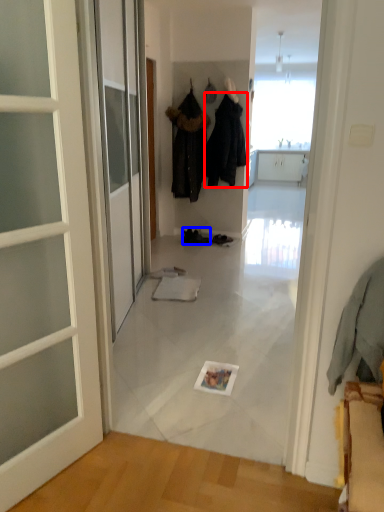
Question: Which object appears closest to the camera in this image, clothing (highlighted by a red box) or footwear (highlighted by a blue box)?

Choices:
 (A) clothing
 (B) footwear

Answer: (A)